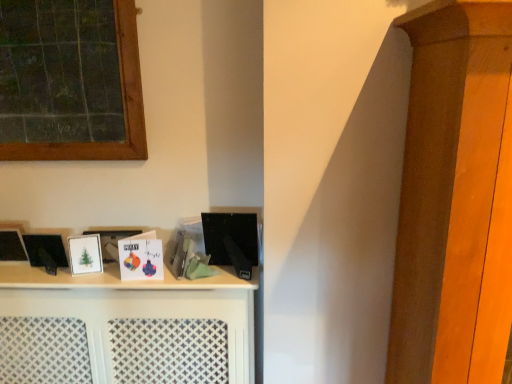
Question: Is matte paper card at center, the second book from the right, bigger or smaller than green chalkboard at upper left?

Choices:
 (A) small
 (B) big

Answer: (A)

Question: Which is correct: matte paper card at center, the second book from the right, is inside green chalkboard at upper left, or outside of it?

Choices:
 (A) outside
 (B) inside

Answer: (A)

Question: Based on their relative distances, which object is nearer to the green chalkboard at upper left?

Choices:
 (A) matte paper card at center, the second book from the right
 (B) white matte shelf at center
 (C) white matte picture frame at left
 (D) matte black book at center, which is the 2th book from left to right

Answer: (A)

Question: Which object is the closest to the green chalkboard at upper left?

Choices:
 (A) matte paper card at center, the 1th book viewed from the left
 (B) white matte picture frame at left
 (C) matte black book at center, which is the 2th book from left to right
 (D) white matte shelf at center

Answer: (A)